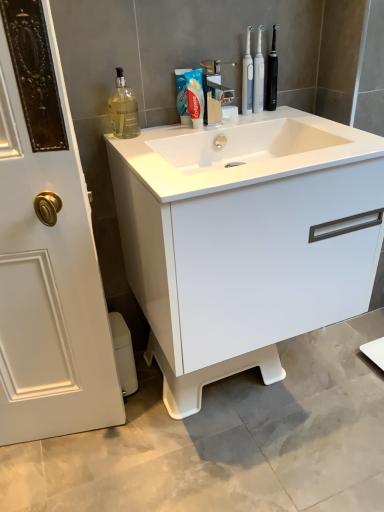
Where is `vacant space in front of black plastic toothbrush at upper right, placed as the 2th toiletry when sorted from left to right`? This screenshot has height=512, width=384. vacant space in front of black plastic toothbrush at upper right, placed as the 2th toiletry when sorted from left to right is located at coordinates (286, 117).